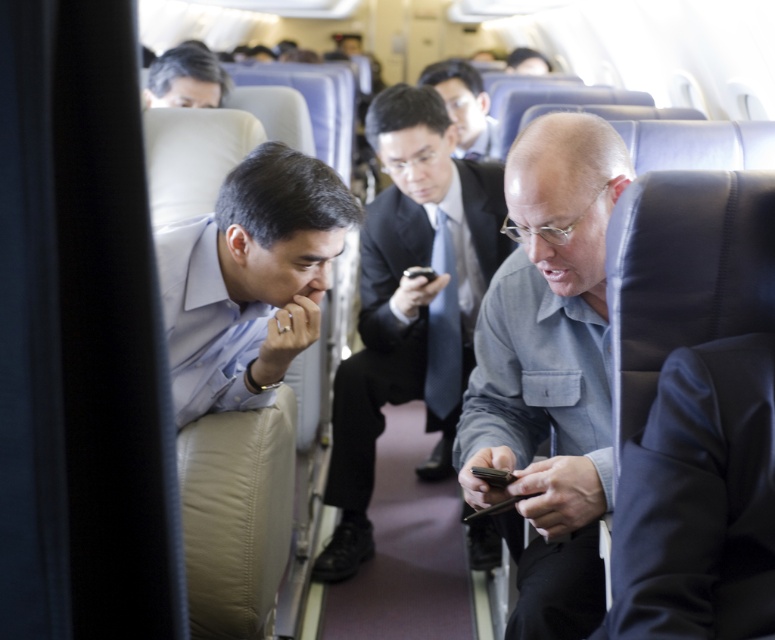
Question: From the image, what is the correct spatial relationship of smooth black suit at center in relation to gray hair at upper center?

Choices:
 (A) below
 (B) above

Answer: (B)

Question: Which of the following is the closest to the observer?

Choices:
 (A) (467, 109)
 (B) (558, 557)

Answer: (B)

Question: Which point is farther from the camera taking this photo?

Choices:
 (A) (288, 182)
 (B) (600, 593)
 (C) (448, 68)
 (D) (448, 244)

Answer: (C)

Question: Can you confirm if matte black suit at center is wider than smooth black suit at center?

Choices:
 (A) yes
 (B) no

Answer: (A)

Question: Can you confirm if gray fabric shirt at center is bigger than smooth black suit at center?

Choices:
 (A) yes
 (B) no

Answer: (B)

Question: Among these points, which one is farthest from the camera?

Choices:
 (A) (338, 406)
 (B) (491, 141)
 (C) (198, 49)
 (D) (549, 310)

Answer: (B)